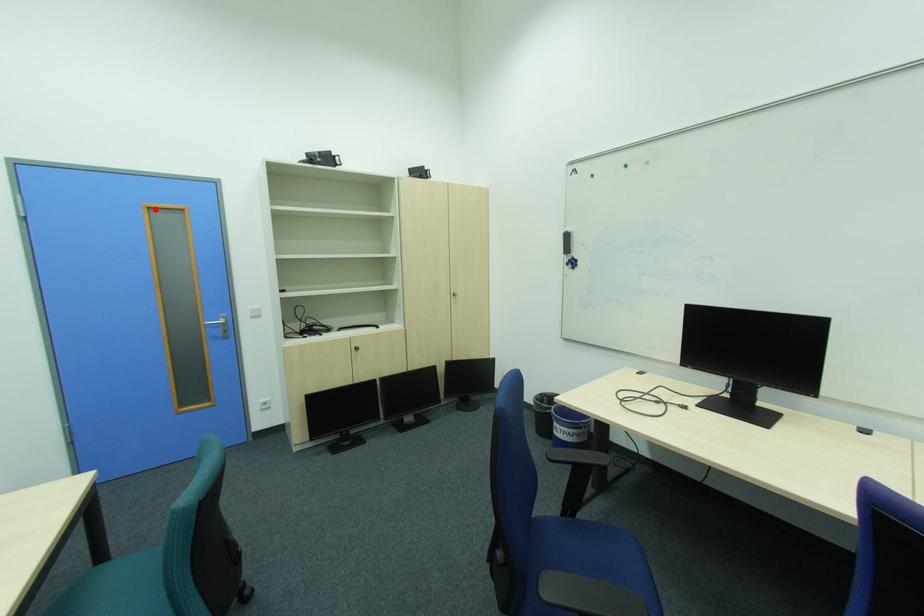
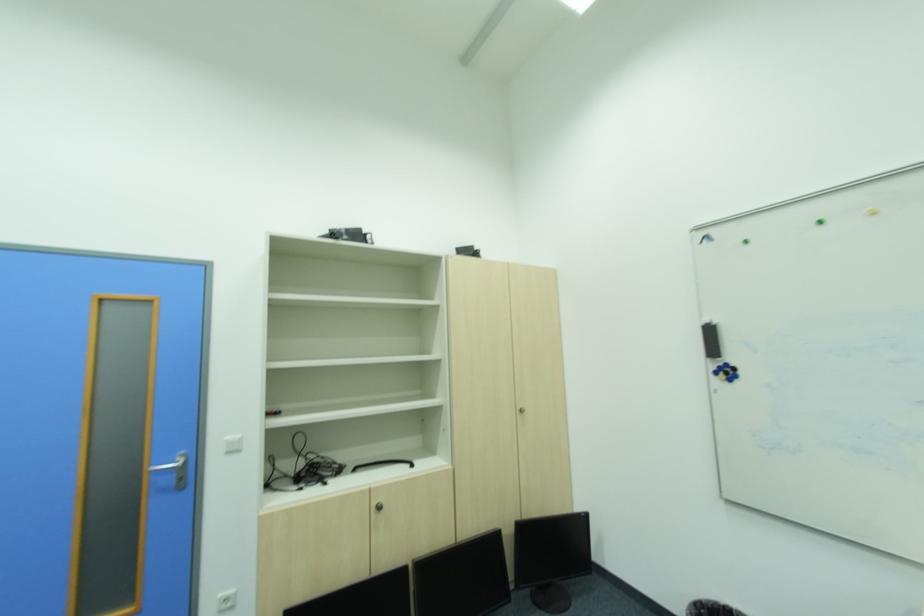
Locate, in the second image, the point that corresponds to the highlighted location in the first image.

(111, 300)